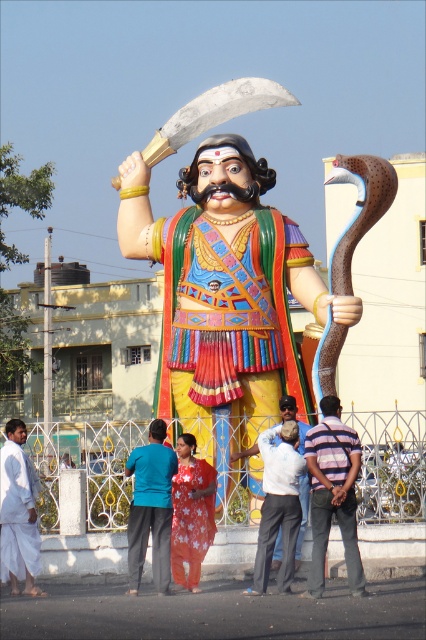
You are a photographer trying to capture a clear shot of the shiny silver blade at upper center and the white cotton shirt at center. Since you want both objects in focus, you need to know which one is taller. Which object is taller?

The shiny silver blade at upper center is taller than the white cotton shirt at center, so you should adjust your camera settings to focus on the taller object first to ensure both are in focus.

You are a photographer trying to capture the statue and the people around it. You notice the blue fabric pants at center and the white cloth at lower left in your frame. Which object should you focus on if you want to highlight something larger in your photo?

You should focus on the blue fabric pants at center because it is larger than the white cloth at lower left.

You are a tourist visiting the statue and want to place a small offering on the ground near the statue. The offering requires a flat surface. Is there a white cloth at lower left available for placing it?

Yes, there is a white cloth at lower left available for placing the offering as it is located at point [19,513].